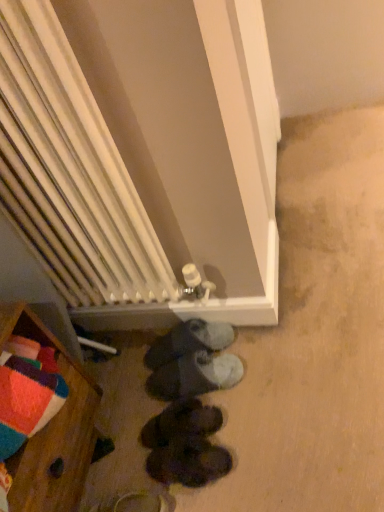
Question: Can you confirm if dark brown leather shoes at center, the fourth footwear when ordered from top to bottom, is shorter than white radiator at center?

Choices:
 (A) no
 (B) yes

Answer: (B)

Question: Considering the relative sizes of dark brown leather shoes at center, which ranks as the first footwear in bottom-to-top order, and white radiator at center in the image provided, is dark brown leather shoes at center, which ranks as the first footwear in bottom-to-top order, taller than white radiator at center?

Choices:
 (A) yes
 (B) no

Answer: (B)

Question: Is dark brown leather shoes at center, which ranks as the first footwear in bottom-to-top order, touching white radiator at center?

Choices:
 (A) yes
 (B) no

Answer: (B)

Question: From a real-world perspective, is dark brown leather shoes at center, the fourth footwear when ordered from top to bottom, physically below white radiator at center?

Choices:
 (A) no
 (B) yes

Answer: (B)

Question: Is dark brown leather shoes at center, the fourth footwear when ordered from top to bottom, located outside white radiator at center?

Choices:
 (A) yes
 (B) no

Answer: (A)

Question: Does dark brown leather shoes at center, the fourth footwear when ordered from top to bottom, appear on the left side of white radiator at center?

Choices:
 (A) yes
 (B) no

Answer: (B)

Question: From a real-world perspective, is black suede shoes at lower center, which appears as the 2th footwear when ordered from the bottom, physically above dark brown leather shoes at center, which ranks as the first footwear in bottom-to-top order?

Choices:
 (A) yes
 (B) no

Answer: (A)

Question: Is black suede shoes at lower center, which appears as the 2th footwear when ordered from the bottom, bigger than dark brown leather shoes at center, which ranks as the first footwear in bottom-to-top order?

Choices:
 (A) no
 (B) yes

Answer: (B)

Question: Is black suede shoes at lower center, the 3th footwear when ordered from top to bottom, far from dark brown leather shoes at center, which ranks as the first footwear in bottom-to-top order?

Choices:
 (A) no
 (B) yes

Answer: (A)

Question: Is black suede shoes at lower center, the 3th footwear when ordered from top to bottom, positioned in front of dark brown leather shoes at center, the fourth footwear when ordered from top to bottom?

Choices:
 (A) no
 (B) yes

Answer: (A)

Question: Can you confirm if black suede shoes at lower center, which appears as the 2th footwear when ordered from the bottom, is taller than dark brown leather shoes at center, which ranks as the first footwear in bottom-to-top order?

Choices:
 (A) yes
 (B) no

Answer: (A)

Question: Does black suede shoes at lower center, the 3th footwear when ordered from top to bottom, have a greater width compared to dark brown leather shoes at center, the fourth footwear when ordered from top to bottom?

Choices:
 (A) no
 (B) yes

Answer: (A)

Question: Is dark gray suede shoes at center, arranged as the third footwear when ordered from the bottom, far away from white radiator at center?

Choices:
 (A) no
 (B) yes

Answer: (A)